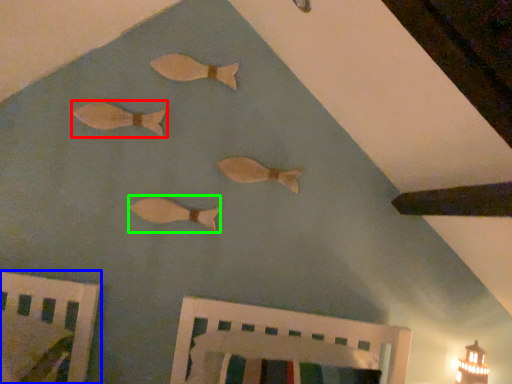
Question: Considering the real-world distances, which object is closest to fish (highlighted by a red box)? furniture (highlighted by a blue box) or fish (highlighted by a green box).

Choices:
 (A) furniture
 (B) fish

Answer: (B)